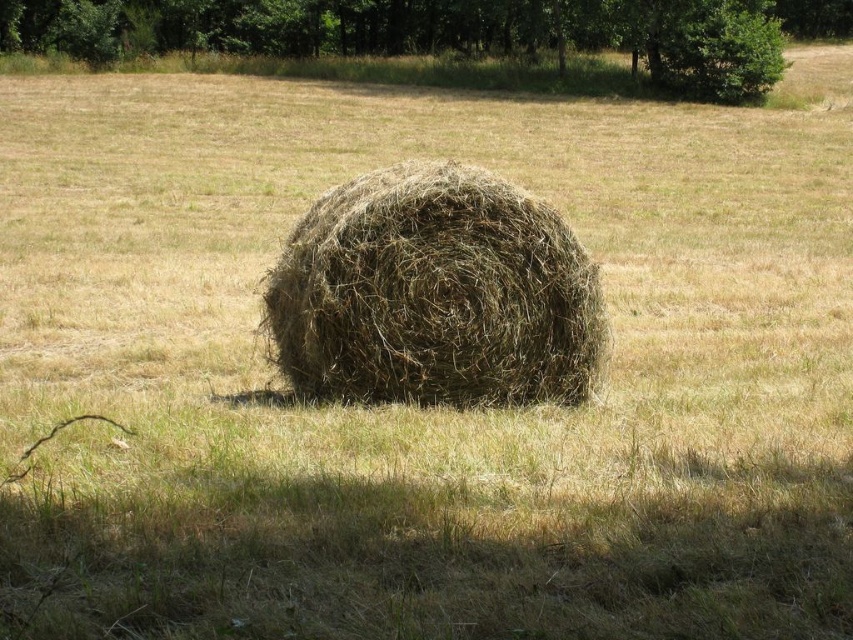
Is point (468, 310) positioned before point (701, 20)?

That is True.

Who is more distant from viewer, (351, 324) or (405, 38)?

Point (405, 38)

Which is in front, point (442, 173) or point (605, 35)?

Positioned in front is point (442, 173).

Locate an element on the screen. The width and height of the screenshot is (853, 640). brown textured hay at center is located at coordinates (434, 292).